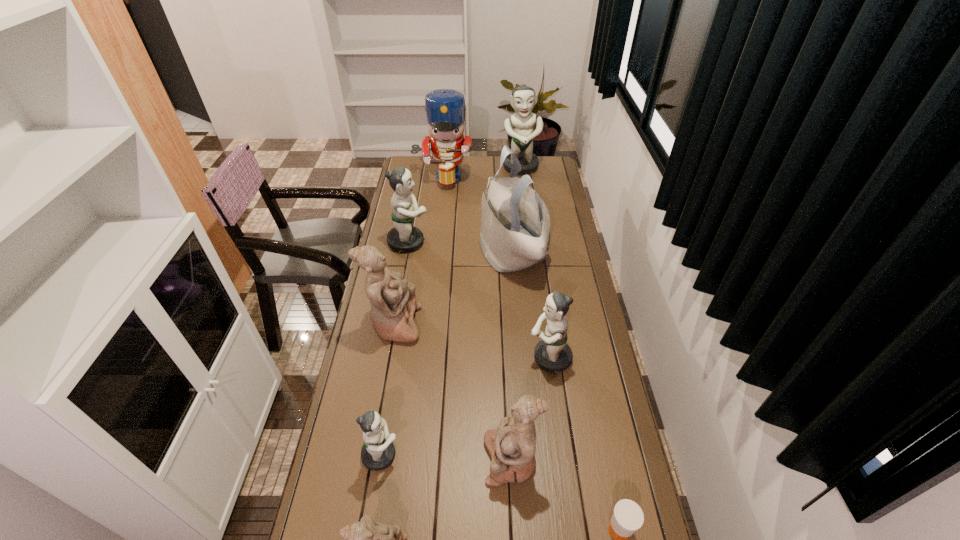
The image size is (960, 540). I want to click on the biggest green figurine, so click(521, 126).

The width and height of the screenshot is (960, 540). Find the location of `the farthest figurine`. the farthest figurine is located at coordinates (521, 126).

Identify the location of nutcracker. This screenshot has width=960, height=540. (445, 108).

Find the location of a particular element. This screenshot has height=540, width=960. shopping bag is located at coordinates (515, 231).

Locate an element on the screen. the biggest white figurine is located at coordinates (393, 302).

The height and width of the screenshot is (540, 960). I want to click on the third nearest green figurine, so click(405, 238).

Locate an element on the screen. the second farthest figurine is located at coordinates (405, 238).

Where is `the third biggest green figurine`? Image resolution: width=960 pixels, height=540 pixels. the third biggest green figurine is located at coordinates (552, 354).

The height and width of the screenshot is (540, 960). What are the coordinates of `the second nearest white figurine` in the screenshot? It's located at (512, 446).

Where is `the second smallest white figurine`? This screenshot has width=960, height=540. the second smallest white figurine is located at coordinates (512, 446).